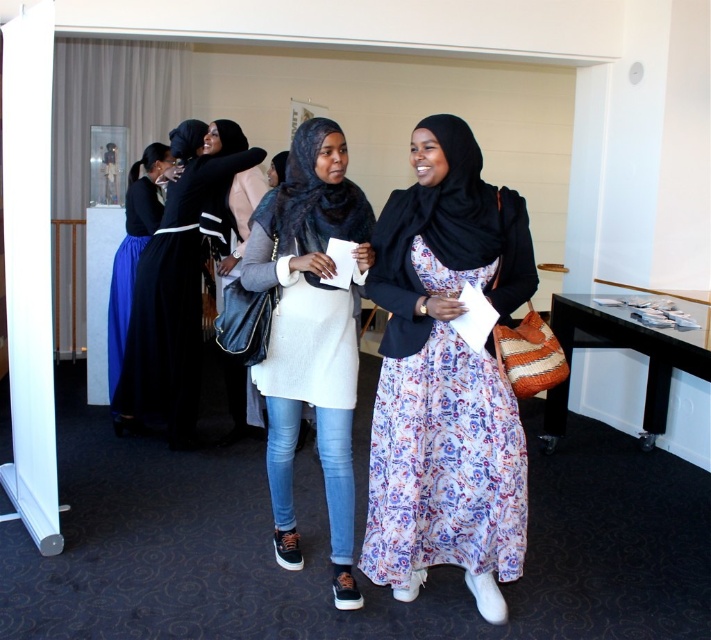
Consider the image. You are an event organizer who needs to arrange seating for two guests wearing the floral silk dress at center and the matte black dress at left. Based on their positions in the image, which guest should be seated closer to the front of the stage?

The floral silk dress at center should be seated closer to the front of the stage because it is positioned under the matte black dress at left, indicating it is in a lower, more forward position.

You are a photographer setting up for a group photo. You need to position the white textured dress at center and the matte black dress at left so that they are exactly 2 meters apart. Based on their current positions, do you need to move them closer or farther apart?

The current distance between the white textured dress at center and the matte black dress at left is 1.70 meters. To reach the desired 2 meters, you should move them farther apart.